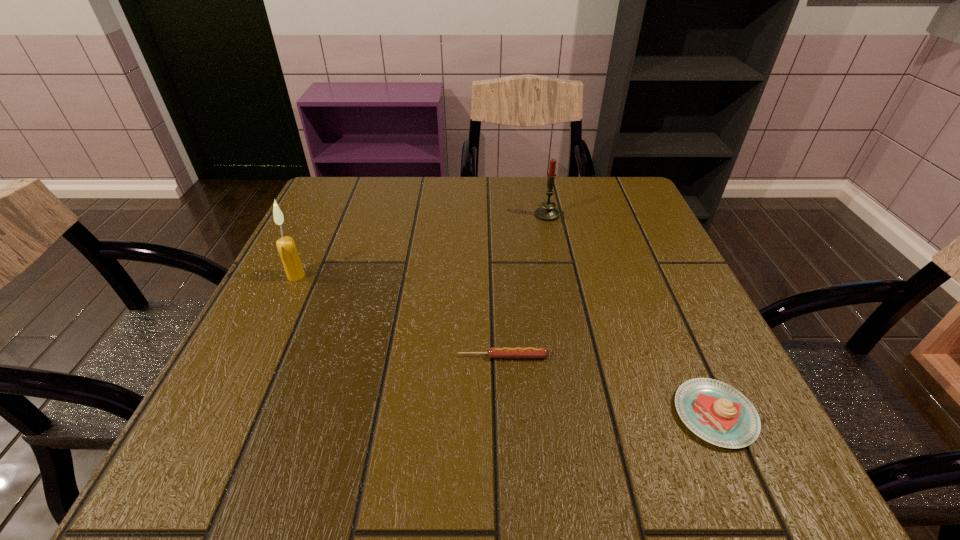
Locate an element on the screen. The height and width of the screenshot is (540, 960). vacant space located on the back of the pastry is located at coordinates (650, 270).

You are a GUI agent. You are given a task and a screenshot of the screen. Output one action in this format:
    pyautogui.click(x=<x>, y=<y>)
    Task: Click on the blank area located on the front of the second nearest object
    
    Given the screenshot: What is the action you would take?
    pyautogui.click(x=506, y=420)

What are the coordinates of `object that is at the far edge` in the screenshot? It's located at pyautogui.click(x=547, y=212).

Identify the location of object that is at the near edge. The height and width of the screenshot is (540, 960). (718, 413).

Find the location of `object present at the left edge`. object present at the left edge is located at coordinates (286, 247).

You are a GUI agent. You are given a task and a screenshot of the screen. Output one action in this format:
    pyautogui.click(x=<x>, y=<y>)
    Task: Click on the object situated at the right edge
    This screenshot has height=540, width=960.
    Given the screenshot: What is the action you would take?
    pyautogui.click(x=718, y=413)

At what (x,y) coordinates should I click in order to perform the action: click on object at the near right corner. Please return your answer as a coordinate pair (x, y). The image size is (960, 540). Looking at the image, I should click on (718, 413).

Where is `vacant region at the far edge`? The height and width of the screenshot is (540, 960). vacant region at the far edge is located at coordinates (528, 217).

This screenshot has width=960, height=540. In the image, there is a desktop. Find the location of `free region at the left edge`. free region at the left edge is located at coordinates (331, 299).

Locate an element on the screen. vacant space at the right edge of the desktop is located at coordinates (658, 373).